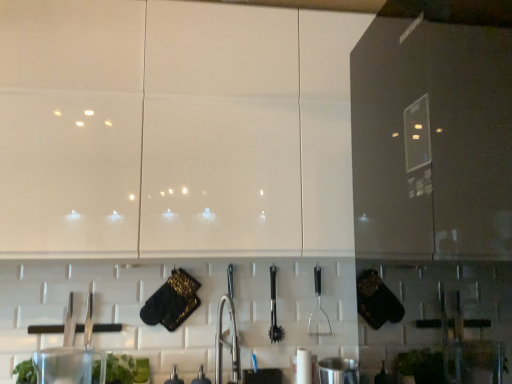
Question: From the image's perspective, is transparent plastic container at lower left, which is the 1th appliance in left-to-right order, under stainless steel pot at lower center, which ranks as the 4th appliance in left-to-right order?

Choices:
 (A) no
 (B) yes

Answer: (A)

Question: Can you see transparent plastic container at lower left, which is the 1th appliance in left-to-right order, touching stainless steel pot at lower center, which ranks as the 4th appliance in left-to-right order?

Choices:
 (A) no
 (B) yes

Answer: (A)

Question: Is transparent plastic container at lower left, which is the 1th appliance in left-to-right order, facing towards stainless steel pot at lower center, the 1th appliance viewed from the right?

Choices:
 (A) no
 (B) yes

Answer: (A)

Question: Can we say transparent plastic container at lower left, which is the 1th appliance in left-to-right order, lies outside stainless steel pot at lower center, which ranks as the 4th appliance in left-to-right order?

Choices:
 (A) yes
 (B) no

Answer: (A)

Question: Does transparent plastic container at lower left, which is the 1th appliance in left-to-right order, appear on the left side of stainless steel pot at lower center, which ranks as the 4th appliance in left-to-right order?

Choices:
 (A) no
 (B) yes

Answer: (B)

Question: From a real-world perspective, is stainless steel pot at lower center, which ranks as the 4th appliance in left-to-right order, physically located above or below polished metal tongs at center, arranged as the 2th silverware when viewed from the right?

Choices:
 (A) above
 (B) below

Answer: (B)

Question: Considering the positions of stainless steel pot at lower center, which ranks as the 4th appliance in left-to-right order, and polished metal tongs at center, arranged as the 2th silverware when viewed from the right, in the image, is stainless steel pot at lower center, which ranks as the 4th appliance in left-to-right order, taller or shorter than polished metal tongs at center, arranged as the 2th silverware when viewed from the right,?

Choices:
 (A) short
 (B) tall

Answer: (A)

Question: Is stainless steel pot at lower center, which ranks as the 4th appliance in left-to-right order, inside or outside of polished metal tongs at center, acting as the 1th silverware starting from the left?

Choices:
 (A) inside
 (B) outside

Answer: (B)

Question: Is point (338, 370) positioned closer to the camera than point (270, 336)?

Choices:
 (A) farther
 (B) closer

Answer: (B)

Question: In the image, is satin nickel faucet at center positioned in front of or behind metallic faucet at center, the third appliance from the left?

Choices:
 (A) behind
 (B) front

Answer: (B)

Question: Based on their sizes in the image, would you say satin nickel faucet at center is bigger or smaller than metallic faucet at center, the 2th appliance when ordered from right to left?

Choices:
 (A) big
 (B) small

Answer: (A)

Question: Do you think satin nickel faucet at center is within metallic faucet at center, the 2th appliance when ordered from right to left, or outside of it?

Choices:
 (A) inside
 (B) outside

Answer: (B)

Question: Considering the positions of satin nickel faucet at center and metallic faucet at center, the third appliance from the left, in the image, is satin nickel faucet at center taller or shorter than metallic faucet at center, the third appliance from the left,?

Choices:
 (A) tall
 (B) short

Answer: (A)

Question: From the image's perspective, is green leafy plant at lower left located above or below metallic faucet at center, the 2th appliance when ordered from right to left?

Choices:
 (A) above
 (B) below

Answer: (A)

Question: Looking at the image, does green leafy plant at lower left seem bigger or smaller compared to metallic faucet at center, the third appliance from the left?

Choices:
 (A) small
 (B) big

Answer: (B)